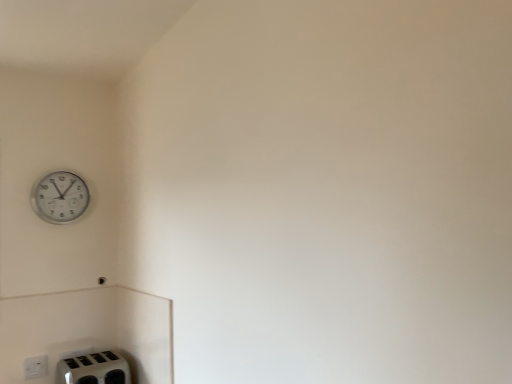
Question: In terms of height, does white plastic toaster at lower left look taller or shorter compared to white plastic wall clock at upper left?

Choices:
 (A) tall
 (B) short

Answer: (B)

Question: Considering the positions of point (108, 362) and point (79, 185), is point (108, 362) closer or farther from the camera than point (79, 185)?

Choices:
 (A) farther
 (B) closer

Answer: (B)

Question: Which object is the closest to the white plastic toaster at lower left?

Choices:
 (A) white plastic wall clock at upper left
 (B) white plastic electric outlet at lower left

Answer: (B)

Question: Which object is the closest to the white plastic electric outlet at lower left?

Choices:
 (A) white plastic wall clock at upper left
 (B) white plastic toaster at lower left

Answer: (B)